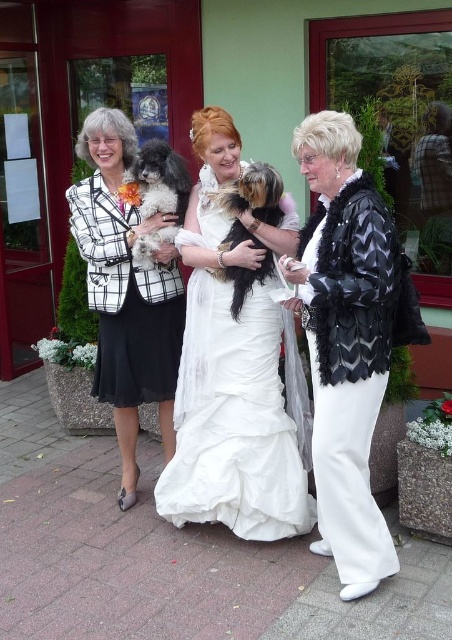
Question: Does matte black blazer at left have a greater width compared to fuzzy brown dog at center?

Choices:
 (A) yes
 (B) no

Answer: (A)

Question: Which point appears farthest from the camera in this image?

Choices:
 (A) (292, 218)
 (B) (103, 246)

Answer: (B)

Question: Can you confirm if matte black blazer at left is positioned to the right of fuzzy brown dog at center?

Choices:
 (A) no
 (B) yes

Answer: (A)

Question: From the image, what is the correct spatial relationship of white satin dress at center in relation to fuzzy brown dog at center?

Choices:
 (A) above
 (B) below

Answer: (B)

Question: Which point is closer to the camera?

Choices:
 (A) fuzzy brown dog at center
 (B) white satin dress at center
 (C) black and white fur at center

Answer: (B)

Question: Which point is closer to the camera?

Choices:
 (A) (193, 308)
 (B) (150, 204)
 (C) (183, 312)
 (D) (253, 172)

Answer: (D)